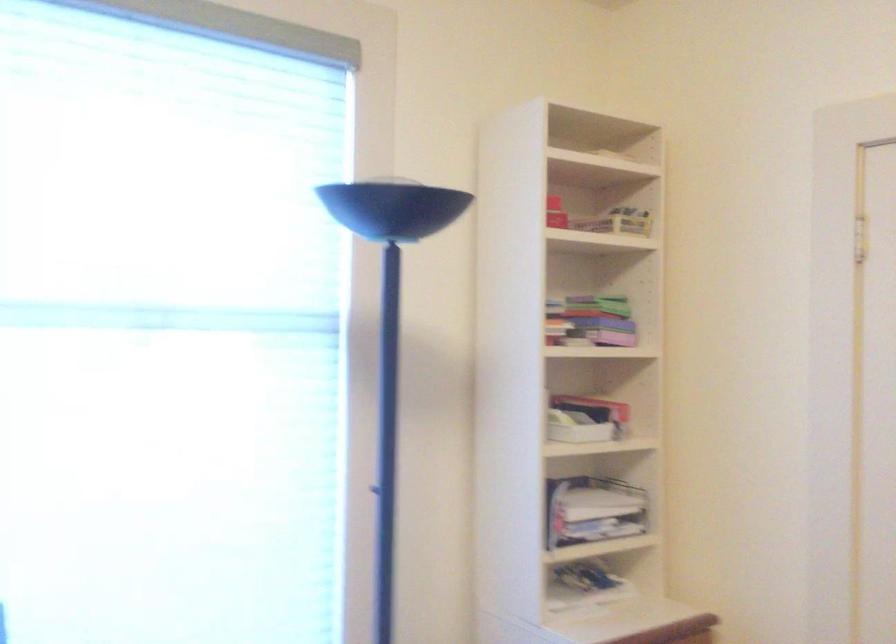
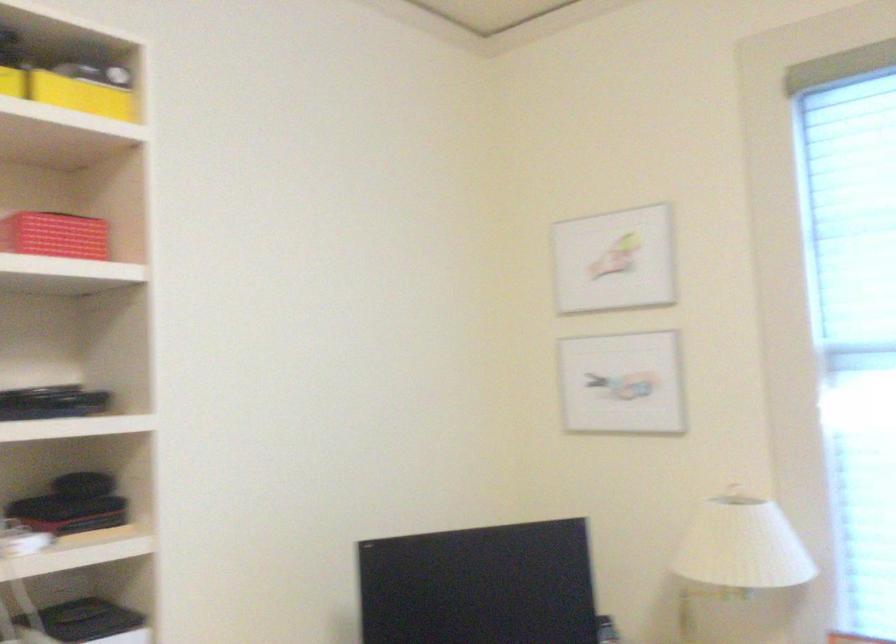
Question: The camera is either moving clockwise (left) or counter-clockwise (right) around the object. The first image is from the beginning of the video and the second image is from the end. Is the camera moving left or right when shooting the video?

Choices:
 (A) Left
 (B) Right

Answer: (B)